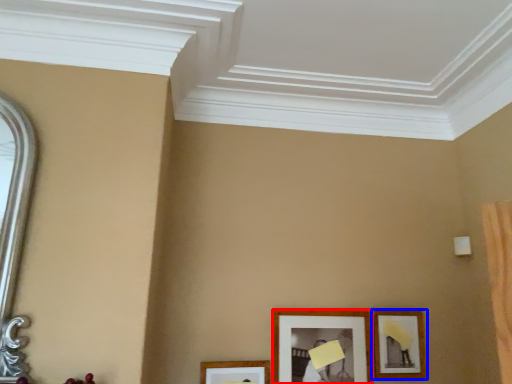
Question: Which of the following is the closest to the observer, picture frame (highlighted by a red box) or picture frame (highlighted by a blue box)?

Choices:
 (A) picture frame
 (B) picture frame

Answer: (A)